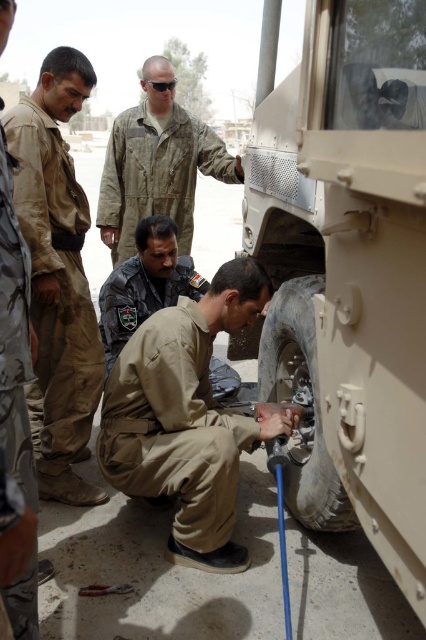
Measure the distance between tan matte tire at lower center and camera.

tan matte tire at lower center is 37.96 inches away from camera.

How much distance is there between tan matte tire at lower center and tan uniform at center?

tan matte tire at lower center and tan uniform at center are 23.63 inches apart from each other.

You are a GUI agent. You are given a task and a screenshot of the screen. Output one action in this format:
    pyautogui.click(x=<x>, y=<y>)
    Task: Click on the tan matte tire at lower center
    Image resolution: width=426 pixels, height=640 pixels.
    Given the screenshot: What is the action you would take?
    pyautogui.click(x=348, y=273)

From the picture: Is tan matte tire at lower center to the right of gray rubber tire at lower center from the viewer's perspective?

Correct, you'll find tan matte tire at lower center to the right of gray rubber tire at lower center.

Is tan matte tire at lower center bigger than gray rubber tire at lower center?

Indeed, tan matte tire at lower center has a larger size compared to gray rubber tire at lower center.

Does point (411, 232) come farther from viewer compared to point (314, 428)?

No, (411, 232) is closer to viewer.

Find the location of `tan matte tire at lower center`. tan matte tire at lower center is located at coordinates click(348, 273).

From the picture: Between gray rubber tire at lower center and brown uniform at center, which one is positioned lower?

gray rubber tire at lower center

This screenshot has height=640, width=426. Describe the element at coordinates (302, 404) in the screenshot. I see `gray rubber tire at lower center` at that location.

I want to click on gray rubber tire at lower center, so click(x=302, y=404).